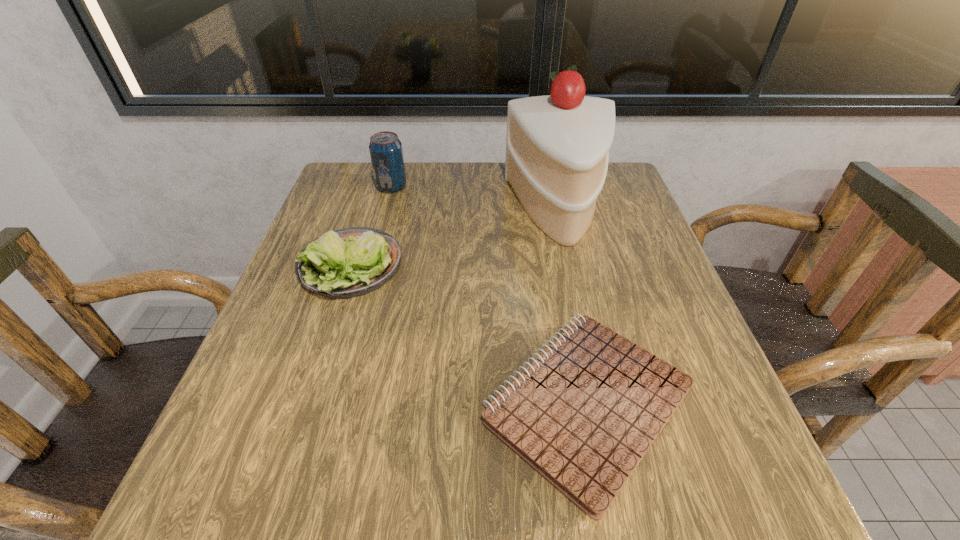
Find the location of a particular element. The image size is (960, 540). vacant space at the near edge of the desktop is located at coordinates (502, 530).

Image resolution: width=960 pixels, height=540 pixels. I want to click on blank area at the left edge, so click(x=330, y=215).

Locate an element on the screen. This screenshot has height=540, width=960. vacant region at the right edge is located at coordinates (608, 260).

You are a GUI agent. You are given a task and a screenshot of the screen. Output one action in this format:
    pyautogui.click(x=<x>, y=<y>)
    Task: Click on the vacant space at the far left corner of the desktop
    Image resolution: width=960 pixels, height=540 pixels.
    Given the screenshot: What is the action you would take?
    pyautogui.click(x=365, y=177)

The image size is (960, 540). In the image, there is a desktop. What are the coordinates of `vacant space at the far right corner` in the screenshot? It's located at (617, 164).

Where is `vacant region at the near right corner of the desktop`? The height and width of the screenshot is (540, 960). vacant region at the near right corner of the desktop is located at coordinates (721, 485).

Locate an element on the screen. This screenshot has height=540, width=960. free spot between the cake and the shortest object is located at coordinates (573, 307).

I want to click on free space that is in between the shortest object and the lettuce, so point(469,335).

Locate an element on the screen. free space between the shortest object and the lettuce is located at coordinates (469, 335).

You are a GUI agent. You are given a task and a screenshot of the screen. Output one action in this format:
    pyautogui.click(x=<x>, y=<y>)
    Task: Click on the vacant space that is in between the lettuce and the tallest object
    
    Given the screenshot: What is the action you would take?
    pyautogui.click(x=455, y=238)